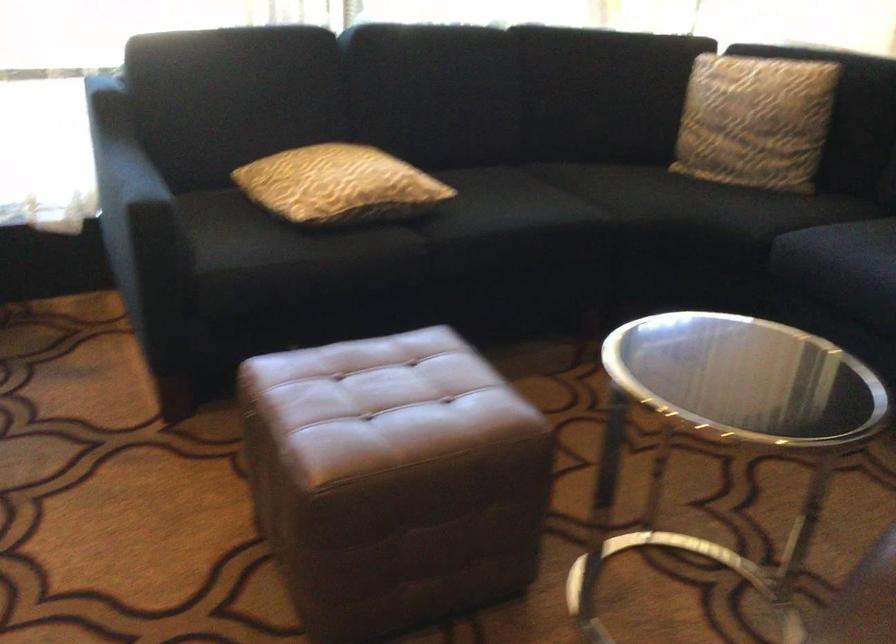
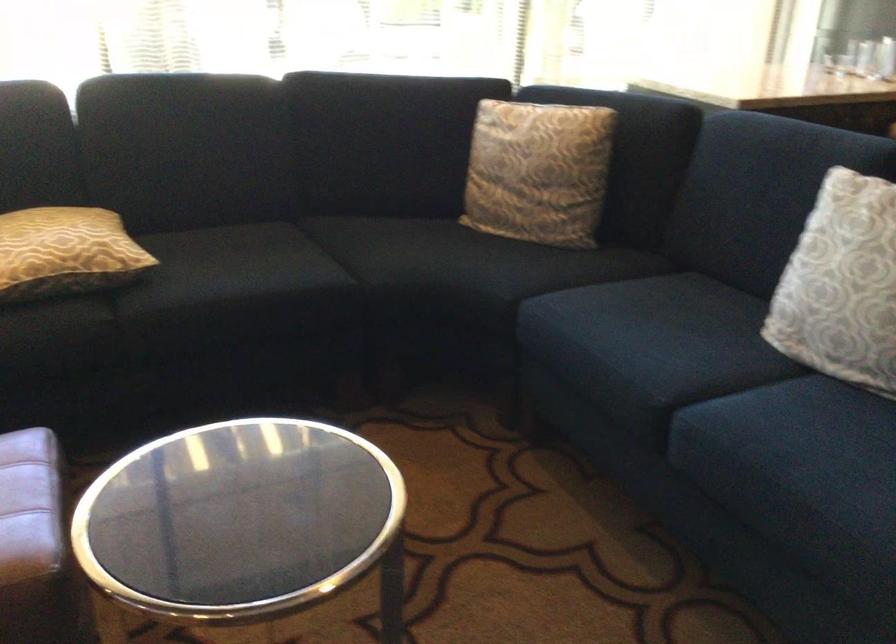
Where in the second image is the point corresponding to pixel 762 114 from the first image?

(538, 172)